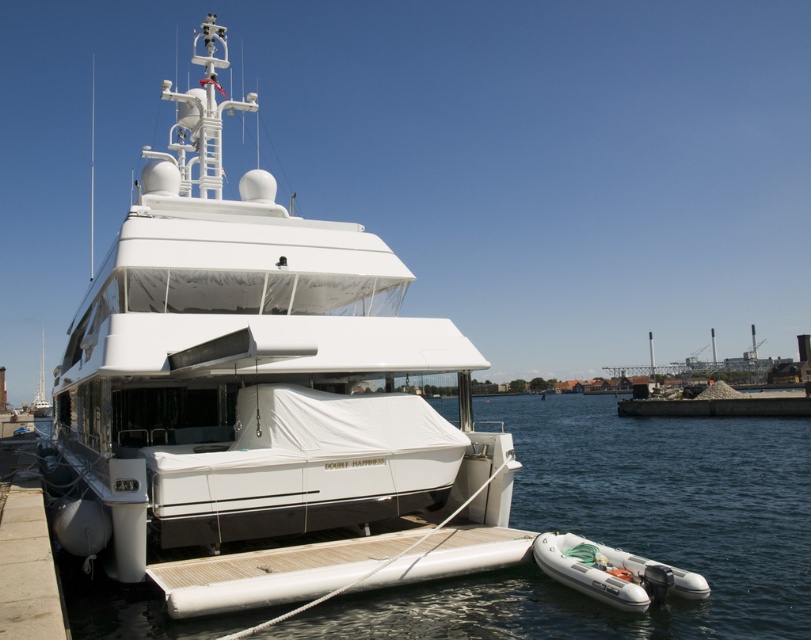
From the picture: Is white glossy yacht at center taller than white rubber dinghy at lower right?

Yes.

Between white glossy yacht at center and white rubber dinghy at lower right, which one has more height?

With more height is white glossy yacht at center.

Which is in front, point (174, 525) or point (644, 586)?

Point (644, 586) is in front.

At what (x,y) coordinates should I click in order to perform the action: click on white glossy yacht at center. Please return your answer as a coordinate pair (x, y). The image size is (811, 640). Looking at the image, I should click on (264, 397).

Who is shorter, white rubber dinghy at lower center or white rubber dinghy at lower right?

With less height is white rubber dinghy at lower right.

Can you confirm if white rubber dinghy at lower center is shorter than white rubber dinghy at lower right?

No, white rubber dinghy at lower center is not shorter than white rubber dinghy at lower right.

Between point (721, 493) and point (621, 563), which one is positioned in front?

Positioned in front is point (621, 563).

In order to click on white rubber dinghy at lower center in this screenshot , I will do `click(624, 529)`.

Between white glossy yacht at center and white rubber dinghy at lower center, which one is positioned lower?

white rubber dinghy at lower center is lower down.

Measure the distance between white glossy yacht at center and camera.

white glossy yacht at center and camera are 31.58 feet apart.

Between point (215, 67) and point (745, 467), which one is positioned behind?

Point (745, 467)

Image resolution: width=811 pixels, height=640 pixels. What are the coordinates of `white glossy yacht at center` in the screenshot? It's located at (264, 397).